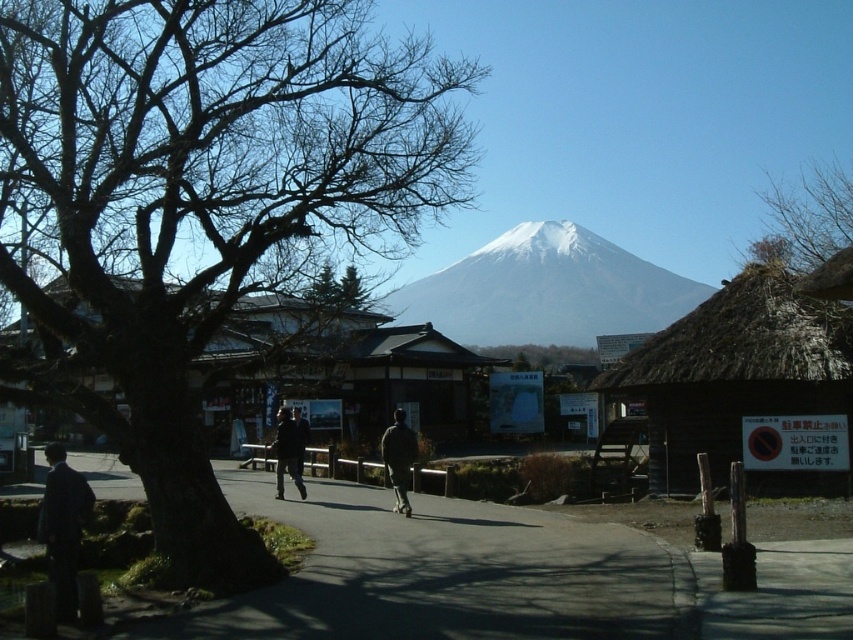
Question: Estimate the real-world distances between objects in this image. Which object is closer to the dark gray jacket at center?

Choices:
 (A) dark gray suit at lower left
 (B) thatched wood hut at right
 (C) dark brown leather jacket at center

Answer: (C)

Question: Is dark brown bark tree at left thinner than dark gray suit at center?

Choices:
 (A) yes
 (B) no

Answer: (B)

Question: Can you confirm if asphalt pavement at center is wider than bare branches at upper right?

Choices:
 (A) no
 (B) yes

Answer: (A)

Question: Among these points, which one is nearest to the camera?

Choices:
 (A) (45, 486)
 (B) (621, 273)
 (C) (332, 572)
 (D) (280, 465)

Answer: (A)

Question: Among these points, which one is nearest to the camera?

Choices:
 (A) (410, 509)
 (B) (61, 557)
 (C) (547, 296)
 (D) (53, 256)

Answer: (B)

Question: Considering the relative positions of dark brown leather jacket at center and dark gray jacket at center in the image provided, where is dark brown leather jacket at center located with respect to dark gray jacket at center?

Choices:
 (A) above
 (B) below

Answer: (B)